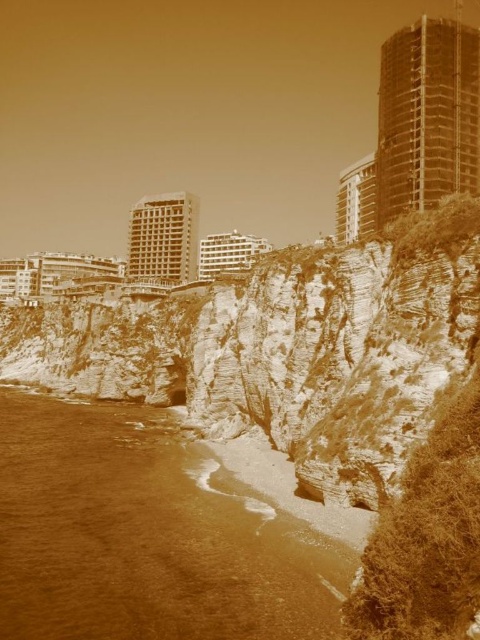
Question: Which object is positioned closest to the smooth concrete building at upper right?

Choices:
 (A) brown sand at lower left
 (B) matte concrete building at center

Answer: (A)

Question: Considering the relative positions of brown sand at lower left and matte concrete building at center in the image provided, where is brown sand at lower left located with respect to matte concrete building at center?

Choices:
 (A) left
 (B) right

Answer: (B)

Question: Is smooth concrete building at upper center further to camera compared to white textured building at center?

Choices:
 (A) no
 (B) yes

Answer: (B)

Question: Which object is the farthest from the matte concrete building at center?

Choices:
 (A) brown sand at lower left
 (B) smooth concrete building at upper center
 (C) smooth concrete building at upper right
 (D) white textured building at center

Answer: (A)

Question: Which point appears farthest from the camera in this image?

Choices:
 (A) (189, 260)
 (B) (46, 412)

Answer: (A)

Question: Where is brown sand at lower left located in relation to smooth concrete building at upper center in the image?

Choices:
 (A) right
 (B) left

Answer: (B)